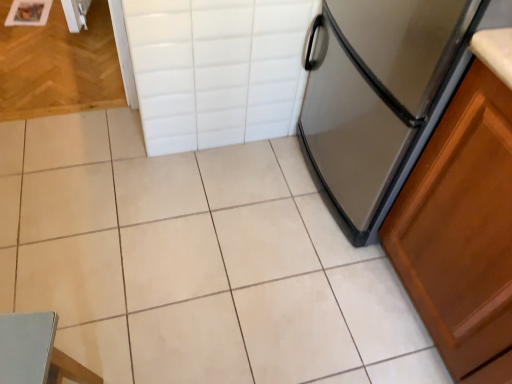
Locate an element on the screen. empty space that is ontop of white ceramic tile at center (from a real-world perspective) is located at coordinates (204, 242).